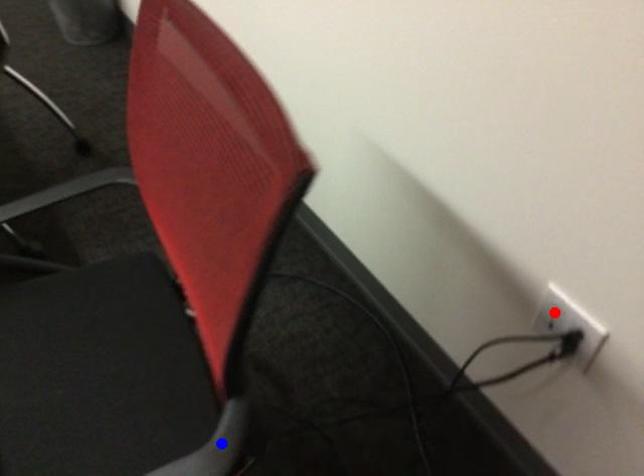
Question: Two points are marked on the image. Which point is closer to the camera?

Choices:
 (A) Blue point is closer.
 (B) Red point is closer.

Answer: (A)